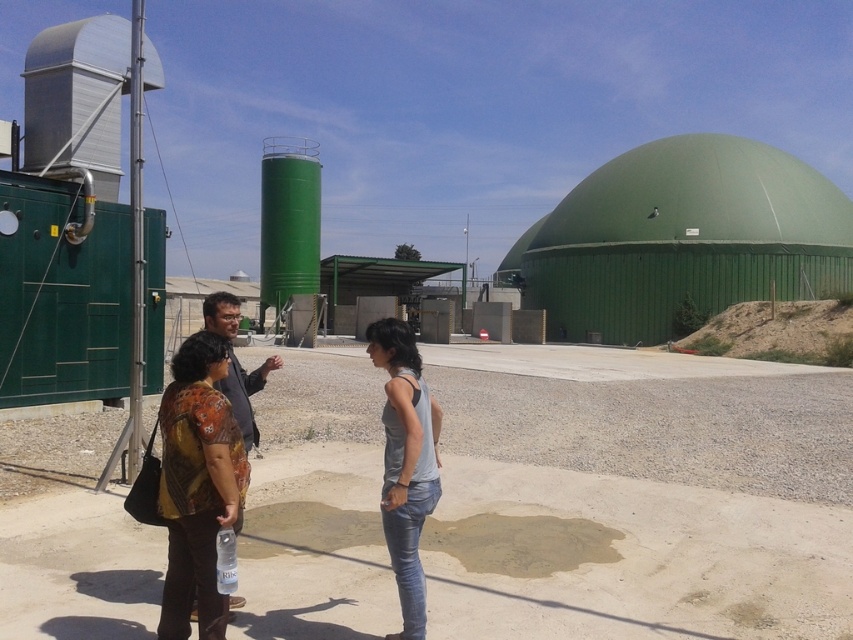
Does gray matte tank top at center have a smaller size compared to matte black shirt at center?

Yes, gray matte tank top at center is smaller than matte black shirt at center.

Find the location of a particular element. This screenshot has width=853, height=640. gray matte tank top at center is located at coordinates (405, 464).

Is point (399, 467) farther from viewer compared to point (257, 429)?

No, (399, 467) is in front of (257, 429).

The width and height of the screenshot is (853, 640). Describe the element at coordinates (395, 385) in the screenshot. I see `printed fabric shirt at center` at that location.

What do you see at coordinates (395, 385) in the screenshot? I see `printed fabric shirt at center` at bounding box center [395, 385].

You are a GUI agent. You are given a task and a screenshot of the screen. Output one action in this format:
    pyautogui.click(x=<x>, y=<y>)
    Task: Click on the printed fabric shirt at center
    
    Given the screenshot: What is the action you would take?
    (x=395, y=385)

Which is below, printed fabric shirt at lower left or matte black shirt at center?

printed fabric shirt at lower left is below.

Does printed fabric shirt at lower left have a lesser height compared to matte black shirt at center?

Yes.

Where is `printed fabric shirt at lower left`? printed fabric shirt at lower left is located at coordinates (196, 484).

The height and width of the screenshot is (640, 853). I want to click on printed fabric shirt at lower left, so click(196, 484).